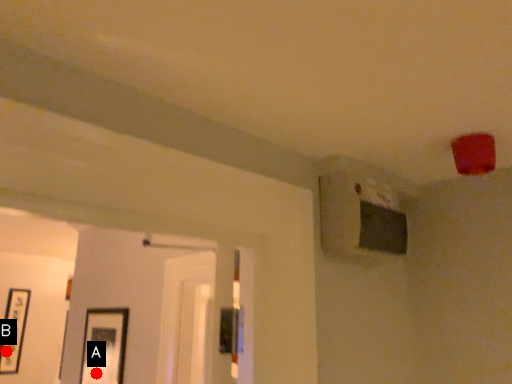
Question: Two points are circled on the image, labeled by A and B beside each circle. Which point is closer to the camera?

Choices:
 (A) A is closer
 (B) B is closer

Answer: (A)